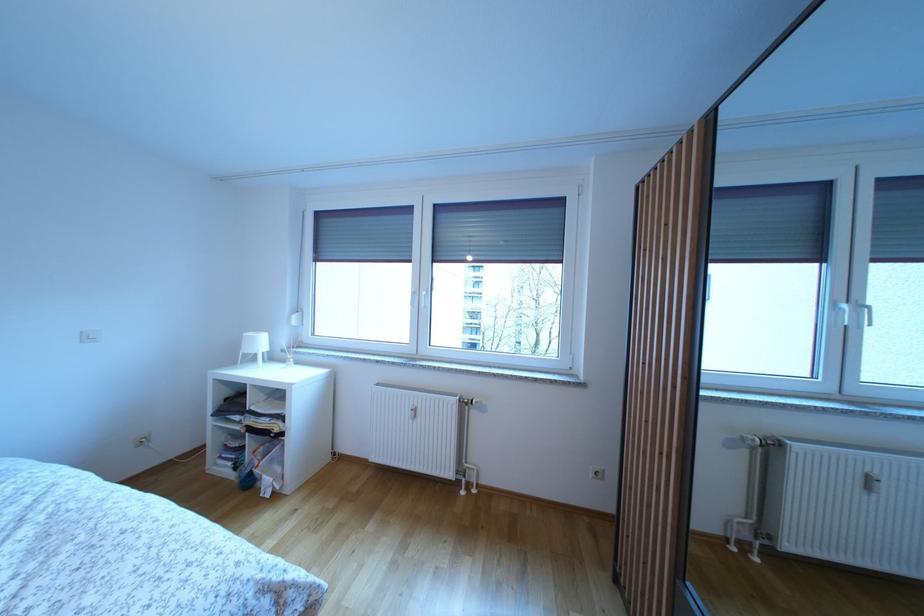
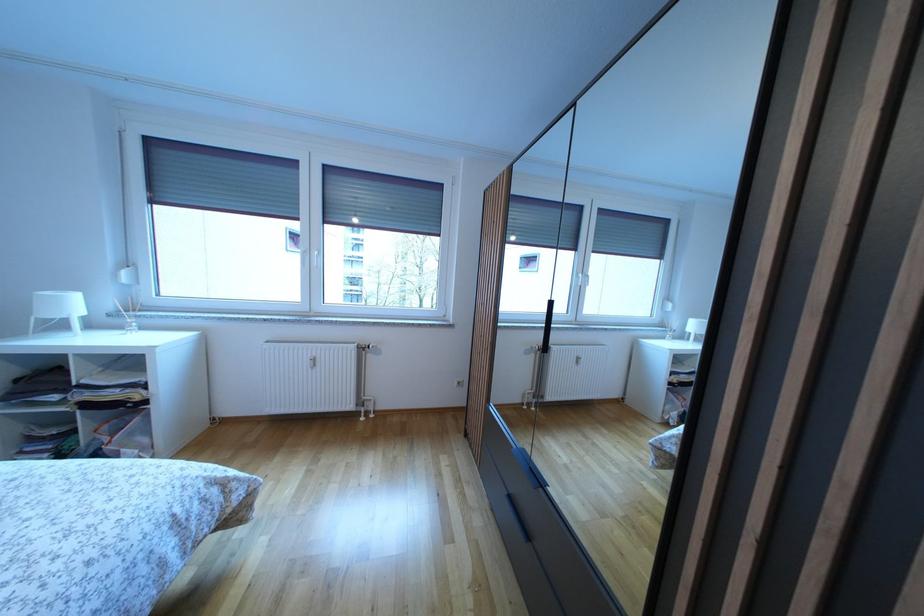
Where in the second image is the point corresponding to (x=289, y=368) from the first image?

(126, 334)